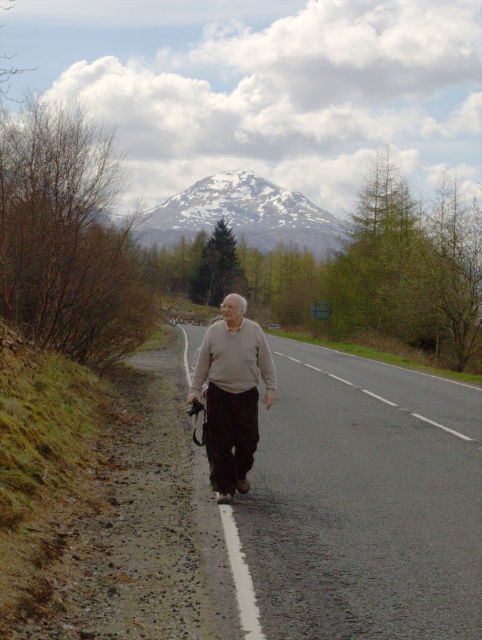
Question: Can you confirm if snowy peak at upper center is bigger than sweater at center?

Choices:
 (A) yes
 (B) no

Answer: (A)

Question: Is snowy peak at upper center in front of sweater at center?

Choices:
 (A) yes
 (B) no

Answer: (B)

Question: Does snowy peak at upper center appear under sweater at center?

Choices:
 (A) no
 (B) yes

Answer: (A)

Question: Which point is farther to the camera?

Choices:
 (A) (253, 435)
 (B) (184, 202)

Answer: (B)

Question: Which of the following is the closest to the observer?

Choices:
 (A) (236, 317)
 (B) (188, 232)

Answer: (A)